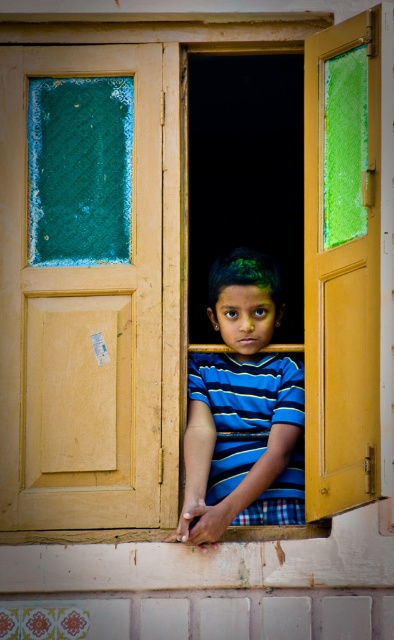
You are a painter who needs to place a 1.5m tall ladder against the yellow matte door at right and the blue striped shirt at center. Which object can the ladder fit next to without exceeding its height?

The yellow matte door at right is much taller than the blue striped shirt at center, so the ladder can fit next to the blue striped shirt at center since it is shorter than the ladder.

You are a delivery person trying to reach the front door of the house. You see the wooden door at center and the yellow matte door at right. Which door is closer to you?

The wooden door at center is 4.51 feet away from the yellow matte door at right, so the wooden door at center is closer to you since it is positioned in front of the yellow matte door at right.

You are standing in a hallway and see the yellow matte door at right and the blue striped shirt at center. Which object is nearer to you?

The yellow matte door at right is closer to the viewer than the blue striped shirt at center.